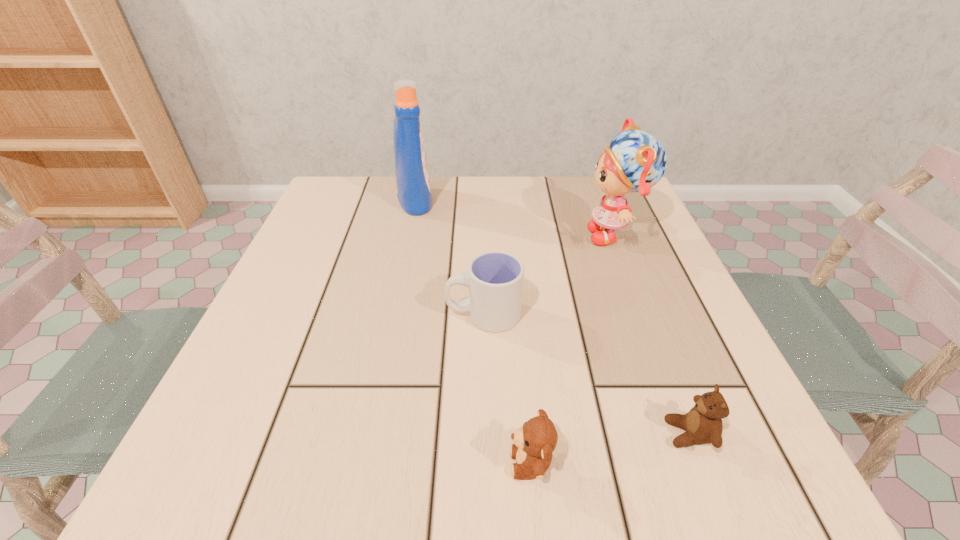
Identify the location of blank space located with the handle on the side of the cup. This screenshot has width=960, height=540. (261, 314).

Locate an element on the screen. Image resolution: width=960 pixels, height=540 pixels. free spot located with the handle on the side of the cup is located at coordinates (334, 314).

Find the location of a particular element. vacant space located 0.050m with the handle on the side of the cup is located at coordinates (419, 314).

This screenshot has width=960, height=540. I want to click on free space located at the face of the right teddy bear, so click(x=624, y=434).

At what (x,y) coordinates should I click in order to perform the action: click on free space located 0.130m at the face of the right teddy bear. Please return your answer as a coordinate pair (x, y). This screenshot has height=540, width=960. Looking at the image, I should click on (573, 434).

At what (x,y) coordinates should I click in order to perform the action: click on blank space located at the face of the right teddy bear. Please return your answer as a coordinate pair (x, y). Looking at the image, I should click on (509, 434).

Where is `vacant space located on the face of the left teddy bear`? The height and width of the screenshot is (540, 960). vacant space located on the face of the left teddy bear is located at coordinates (463, 463).

Where is `free space located on the face of the left teddy bear`? free space located on the face of the left teddy bear is located at coordinates (242, 463).

What are the coordinates of `free region located 0.380m on the face of the left teddy bear` in the screenshot? It's located at (220, 463).

Find the location of `detergent situated at the far edge`. detergent situated at the far edge is located at coordinates (412, 177).